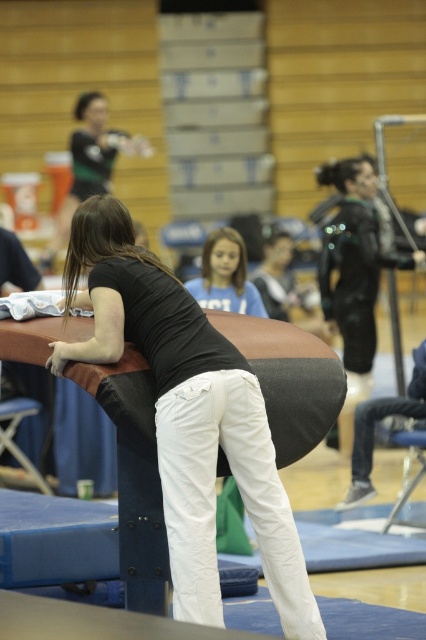
Consider the image. You are standing at the entrance of the gymnasium and see the point at coordinates (187, 416). What object is located at that point?

The point at coordinates (187, 416) corresponds to the matte black shirt at center.